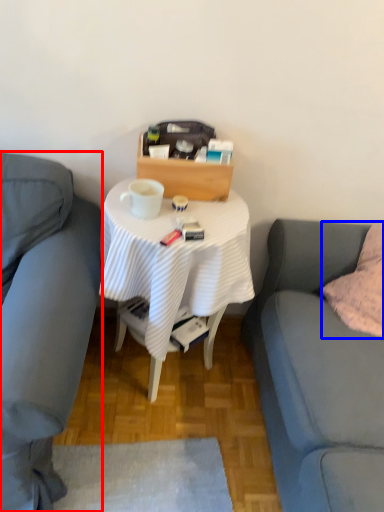
Question: Which point is further to the camera, studio couch (highlighted by a red box) or pillow (highlighted by a blue box)?

Choices:
 (A) studio couch
 (B) pillow

Answer: (B)